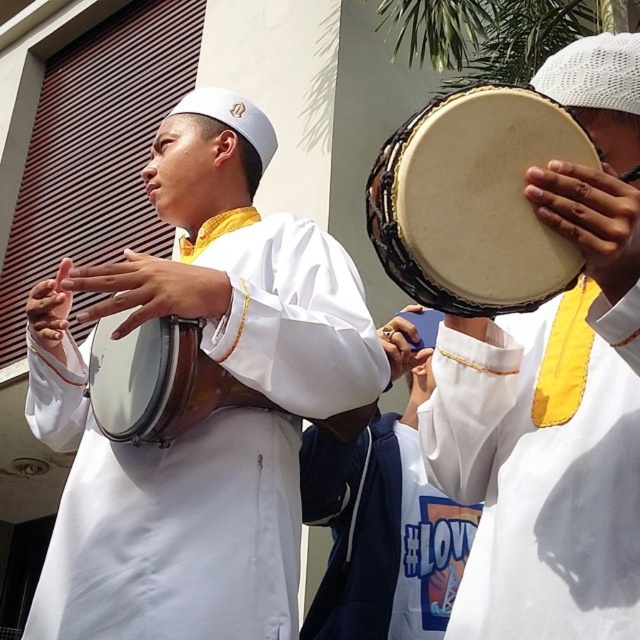
You are a photographer trying to capture the drummer playing the natural wood drum at center and the matte brown drum at center. Which drum should you focus on if you want to photograph the one that is more to the right?

The natural wood drum at center is positioned on the right side of matte brown drum at center, so you should focus on the natural wood drum at center to photograph the one more to the right.

You are taking a photo of the two points in the scene. Which point, point (419, 232) or point (163, 406), will appear larger in your photo?

Point (419, 232) is closer to the camera than point (163, 406), so it will appear larger in the photo.